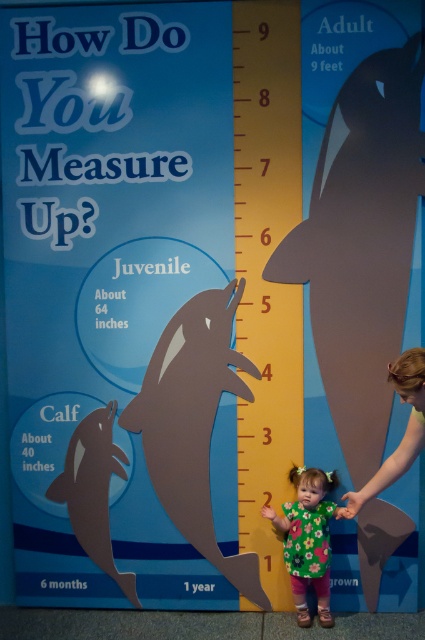
You are a child standing in front of an educational display comparing human growth to killer whales. You see a matte gray dolphin at center and a matte black dolphin at lower left. Which dolphin is closer to you?

The matte gray dolphin at center is closer to you because it is in front of the matte black dolphin at lower left.

You are standing in front of an educational display comparing human growth to killer whales. There are two points marked on the display at coordinates point (329,550) and point (353,497). If you want to touch both points starting from the nearest one, which point should you touch first?

You should touch point (329,550) first because it is closer to you than point (353,497), which is further away.